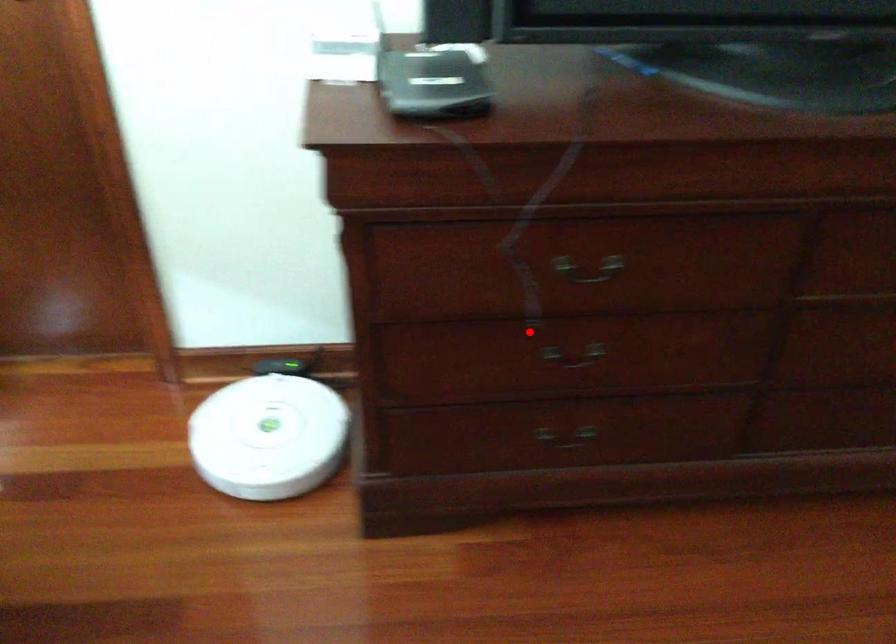
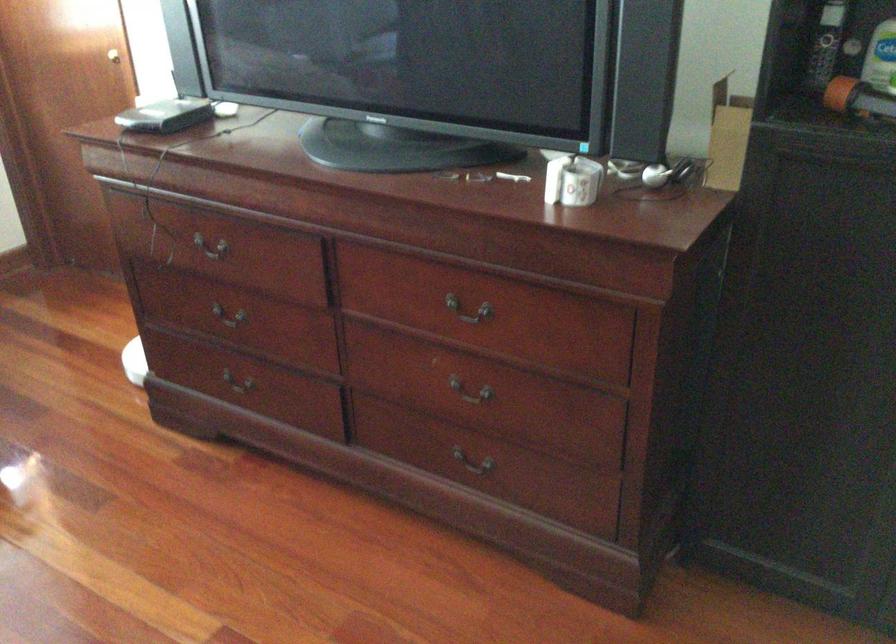
Where in the second image is the point corresponding to the highlighted location from the first image?

(229, 313)